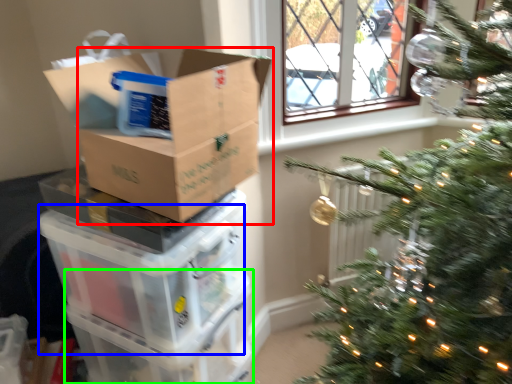
Question: Which is nearer to the cardboard box (highlighted by a red box)? storage box (highlighted by a blue box) or glass box (highlighted by a green box).

Choices:
 (A) storage box
 (B) glass box

Answer: (A)